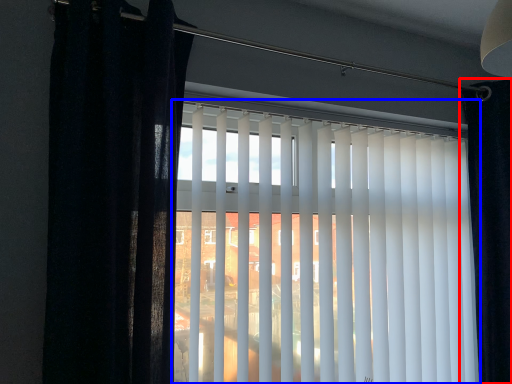
Question: Among these objects, which one is nearest to the camera, curtain (highlighted by a red box) or window blind (highlighted by a blue box)?

Choices:
 (A) curtain
 (B) window blind

Answer: (B)